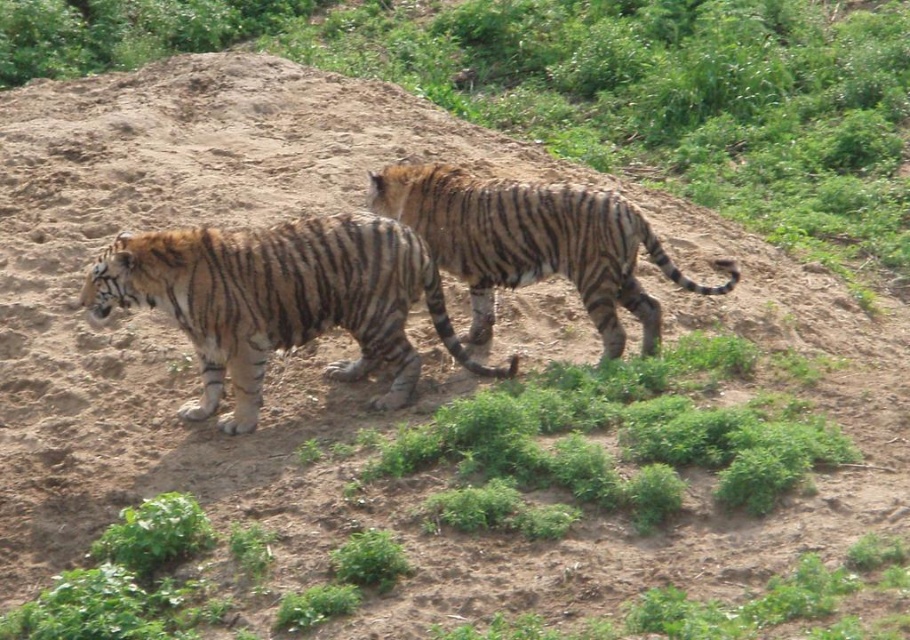
Is orange-brown striped tiger at center above striped fur tiger at center?

Actually, orange-brown striped tiger at center is below striped fur tiger at center.

Does orange-brown striped tiger at center have a greater height compared to striped fur tiger at center?

Yes.

Which is in front, point (95, 314) or point (466, 179)?

Point (95, 314) is more forward.

This screenshot has width=910, height=640. I want to click on orange-brown striped tiger at center, so click(281, 300).